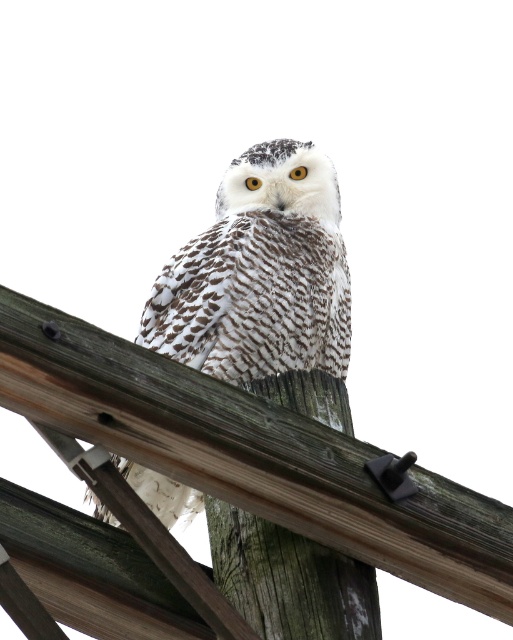
Question: Is white speckled owl at center positioned at the back of wooden at center?

Choices:
 (A) no
 (B) yes

Answer: (B)

Question: Is the position of white speckled owl at center less distant than that of wooden at center?

Choices:
 (A) no
 (B) yes

Answer: (A)

Question: Which point is farther to the camera?

Choices:
 (A) white speckled owl at center
 (B) wooden at center

Answer: (A)

Question: Is white speckled owl at center smaller than wooden at center?

Choices:
 (A) yes
 (B) no

Answer: (B)

Question: Which object appears farthest from the camera in this image?

Choices:
 (A) wooden at center
 (B) white speckled owl at center

Answer: (B)